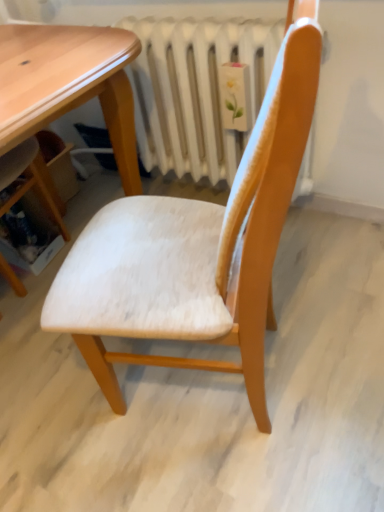
This screenshot has width=384, height=512. What do you see at coordinates (195, 91) in the screenshot?
I see `white painted metal radiator at center` at bounding box center [195, 91].

This screenshot has width=384, height=512. Identify the location of white painted metal radiator at center. (195, 91).

I want to click on white fabric chair at center, so click(x=195, y=250).

Looking at this image, what is the approximate height of white fabric chair at center?

The height of white fabric chair at center is 38.63 inches.

Describe the element at coordinates (195, 250) in the screenshot. I see `white fabric chair at center` at that location.

You are a GUI agent. You are given a task and a screenshot of the screen. Output one action in this format:
    pyautogui.click(x=<x>, y=<y>)
    Task: Click on the white painted metal radiator at center
    The width and height of the screenshot is (384, 512).
    Given the screenshot: What is the action you would take?
    pyautogui.click(x=195, y=91)

Which object is positioned more to the right, white painted metal radiator at center or white fabric chair at center?

white painted metal radiator at center.

Is white painted metal radiator at center closer to the viewer compared to white fabric chair at center?

No, white painted metal radiator at center is further to the viewer.

Is point (192, 90) closer or farther from the camera than point (254, 381)?

Point (192, 90) is positioned farther from the camera compared to point (254, 381).

From the image's perspective, is white painted metal radiator at center on top of white fabric chair at center?

Correct, white painted metal radiator at center appears higher than white fabric chair at center in the image.

From a real-world perspective, relative to white fabric chair at center, is white painted metal radiator at center vertically above or below?

Clearly, from a real-world perspective, white painted metal radiator at center is below white fabric chair at center.

Does white painted metal radiator at center have a greater width compared to white fabric chair at center?

No.

In terms of height, does white painted metal radiator at center look taller or shorter compared to white fabric chair at center?

white painted metal radiator at center is shorter than white fabric chair at center.

Considering the sizes of objects white painted metal radiator at center and white fabric chair at center in the image provided, who is bigger, white painted metal radiator at center or white fabric chair at center?

white fabric chair at center is bigger.

Is white fabric chair at center located within white painted metal radiator at center?

That's incorrect, white fabric chair at center is not inside white painted metal radiator at center.

Is white painted metal radiator at center not near white fabric chair at center?

white painted metal radiator at center is actually quite close to white fabric chair at center.

Is white painted metal radiator at center facing away from white fabric chair at center?

No, white painted metal radiator at center's orientation is not away from white fabric chair at center.

How many degrees apart are the facing directions of white painted metal radiator at center and white fabric chair at center?

They differ by 70.6 degrees in their facing directions.

Locate an element on the screen. The width and height of the screenshot is (384, 512). radiator behind the white fabric chair at center is located at coordinates (195, 91).

Is white fabric chair at center at the right side of white painted metal radiator at center?

No.

Who is more distant, white fabric chair at center or white painted metal radiator at center?

white painted metal radiator at center is further from the camera.

Is point (241, 194) positioned behind point (153, 131)?

No, (241, 194) is closer to viewer.

From the image's perspective, is white fabric chair at center located above white painted metal radiator at center?

No.

From a real-world perspective, is white fabric chair at center below white painted metal radiator at center?

No, from a real-world perspective, white fabric chair at center is not below white painted metal radiator at center.

Which object is thinner, white fabric chair at center or white painted metal radiator at center?

white painted metal radiator at center.

Is white fabric chair at center taller or shorter than white painted metal radiator at center?

white fabric chair at center is taller than white painted metal radiator at center.

In terms of size, does white fabric chair at center appear bigger or smaller than white painted metal radiator at center?

Considering their sizes, white fabric chair at center takes up more space than white painted metal radiator at center.

Is white fabric chair at center outside of white painted metal radiator at center?

Yes, white fabric chair at center is located beyond the bounds of white painted metal radiator at center.

Is white fabric chair at center next to white painted metal radiator at center?

No, white fabric chair at center is not with white painted metal radiator at center.

Is white fabric chair at center turned away from white painted metal radiator at center?

No, white fabric chair at center's orientation is not away from white painted metal radiator at center.

What's the angular difference between white fabric chair at center and white painted metal radiator at center's facing directions?

The facing directions of white fabric chair at center and white painted metal radiator at center are 70.6 degrees apart.

Measure the distance between white fabric chair at center and white painted metal radiator at center.

The distance of white fabric chair at center from white painted metal radiator at center is 26.89 inches.

Locate an element on the screen. chair on the left of white painted metal radiator at center is located at coordinates (195, 250).

This screenshot has width=384, height=512. I want to click on radiator below the white fabric chair at center (from a real-world perspective), so click(x=195, y=91).

Where is `chair above the white painted metal radiator at center (from a real-world perspective)`? This screenshot has width=384, height=512. chair above the white painted metal radiator at center (from a real-world perspective) is located at coordinates (195, 250).